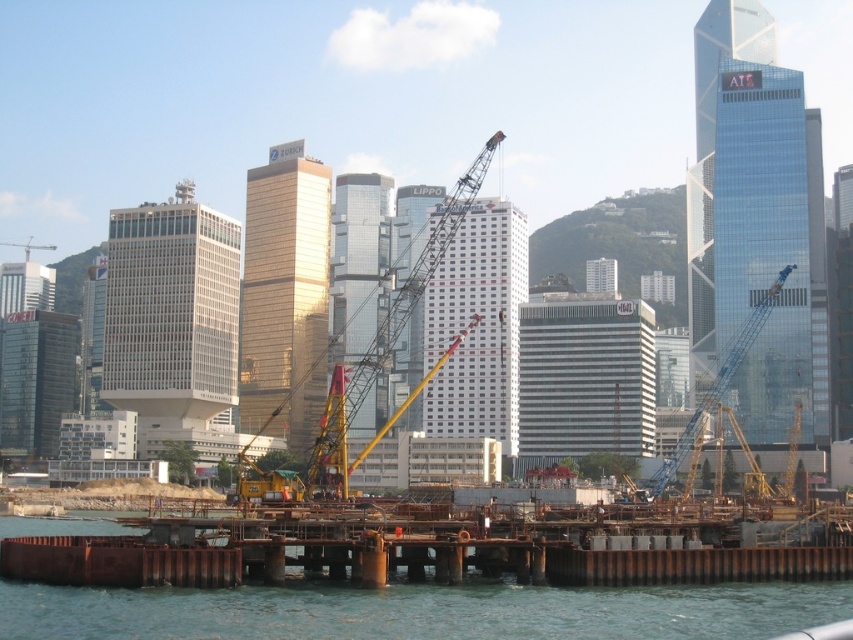
You are a delivery truck driver who needs to park your truck between the yellow metallic crane at center and the blue metallic crane at center. The truck is 50 feet long. Can you park your truck between them without overlapping either crane?

The yellow metallic crane at center is 107.45 feet away from the blue metallic crane at center. Since the truck is 50 feet long, there is enough space between them to park without overlapping either crane.